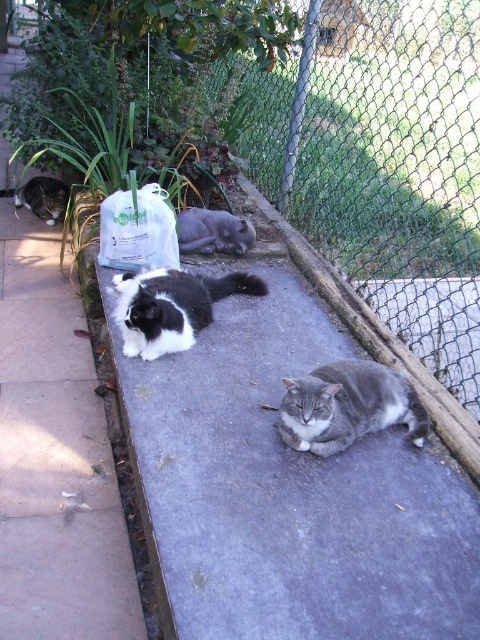
Question: Does black and white fur cat at center appear over black and white fur cat at left?

Choices:
 (A) no
 (B) yes

Answer: (A)

Question: Which object is farther from the camera taking this photo?

Choices:
 (A) white smooth concrete at center
 (B) gray fur cat at center

Answer: (B)

Question: Which object appears farthest from the camera in this image?

Choices:
 (A) black and white fur cat at center
 (B) white smooth concrete at center
 (C) gray fur cat at center
 (D) black and white fur cat at left

Answer: (D)

Question: Observing the image, what is the correct spatial positioning of gray fur cat at center in reference to black and white fur cat at left?

Choices:
 (A) below
 (B) above

Answer: (A)

Question: Can you confirm if gray fluffy cat at center is smaller than white smooth concrete at center?

Choices:
 (A) yes
 (B) no

Answer: (A)

Question: Which object is the farthest from the metal chain-link fence at upper right?

Choices:
 (A) black and white fur cat at left
 (B) gray fluffy cat at center

Answer: (A)